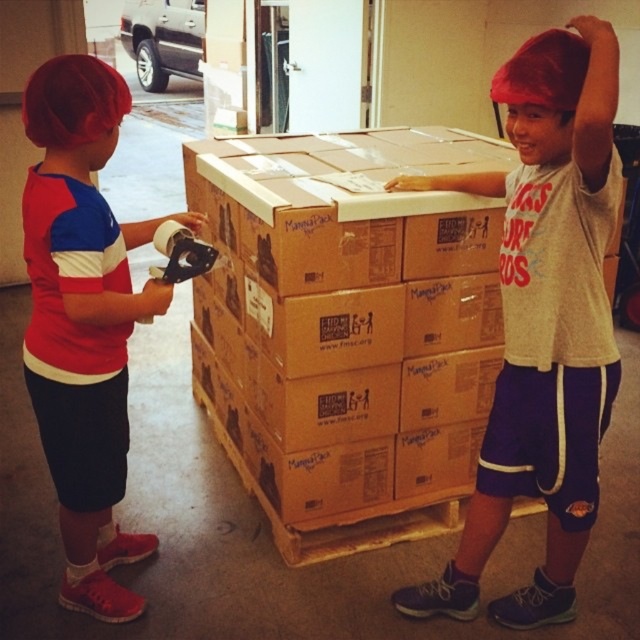
Between matte gray shirt at center and matte red hair at left, which one appears on the left side from the viewer's perspective?

Positioned to the left is matte red hair at left.

Describe the element at coordinates (544, 321) in the screenshot. The height and width of the screenshot is (640, 640). I see `matte gray shirt at center` at that location.

This screenshot has width=640, height=640. I want to click on matte gray shirt at center, so click(544, 321).